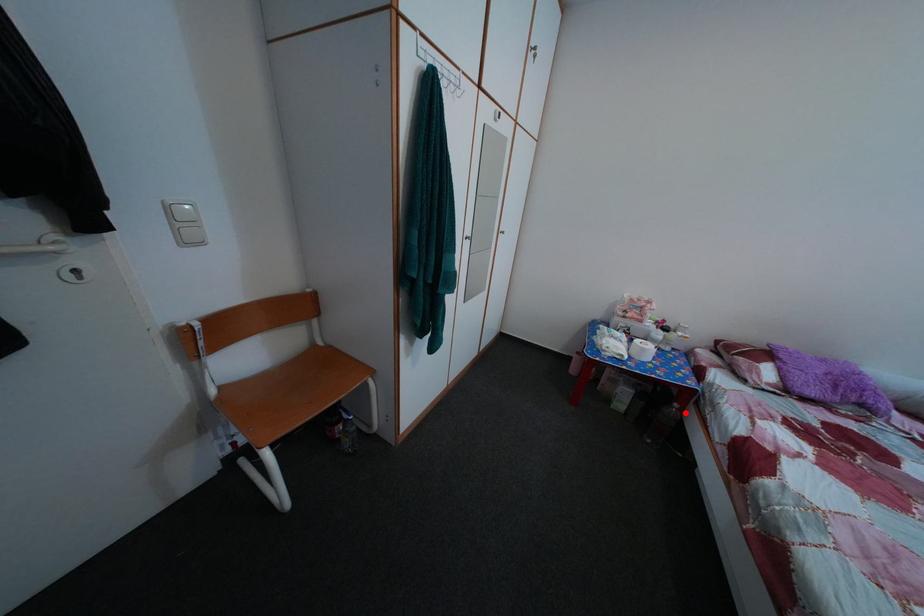
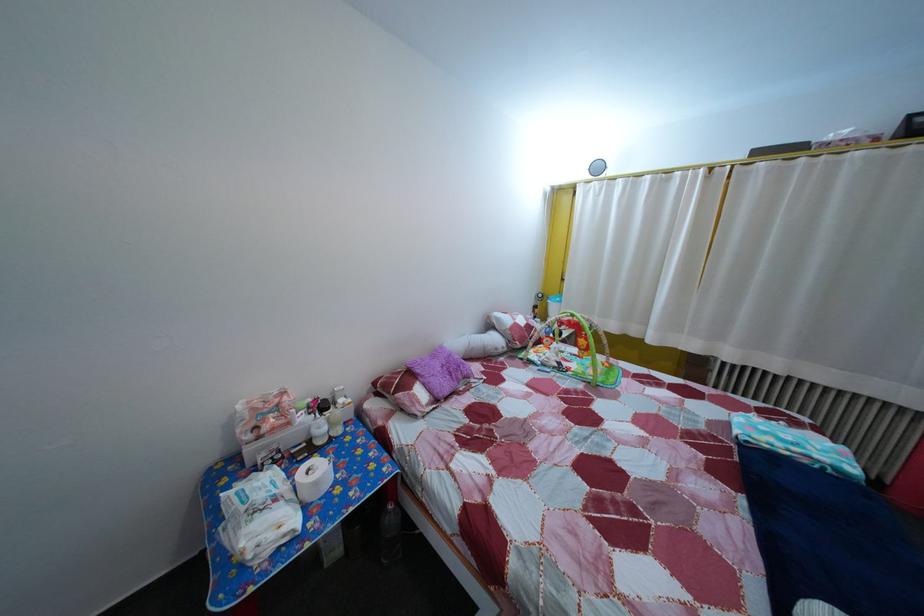
In the second image, find the point that corresponds to the highlighted location in the first image.

(399, 515)